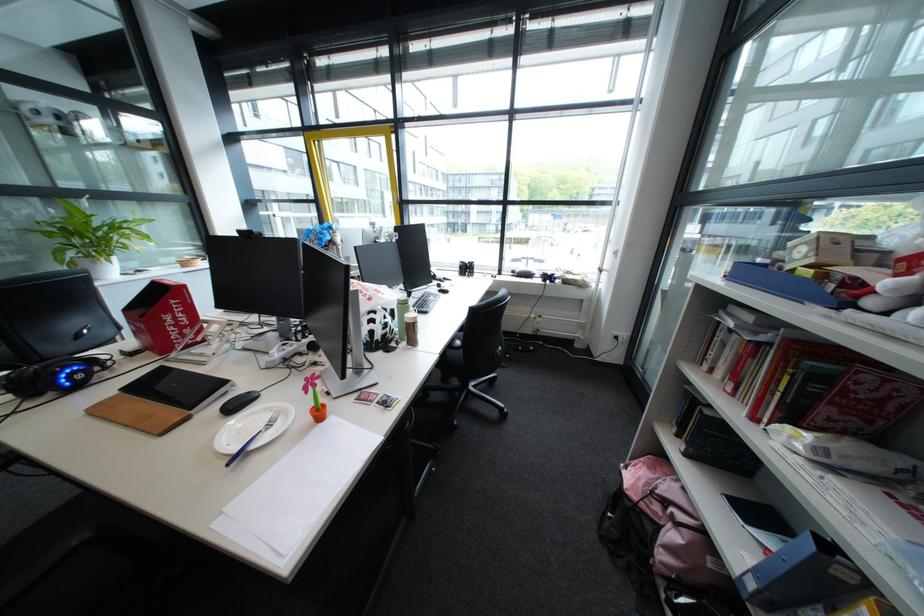
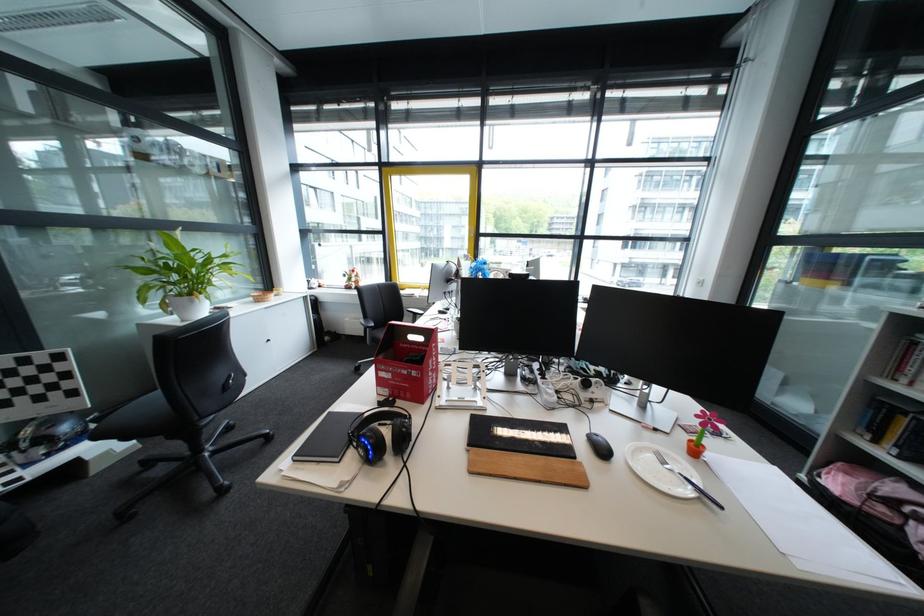
Find the pixel in the second image that matches point (135, 391) in the first image.

(481, 446)